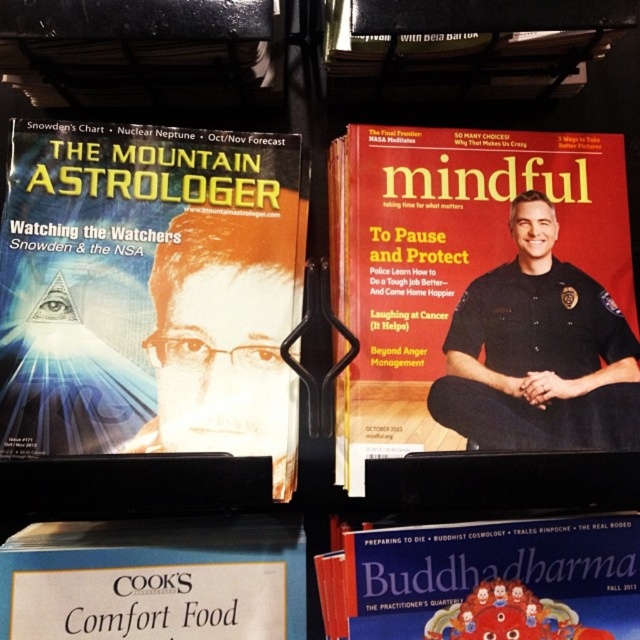
You are organizing a display in a bookstore and need to place the matte paper buddha dharma at center and the white paper comfort food at lower left on a shelf. Based on their sizes, which one should you place first to ensure stability?

The matte paper buddha dharma at center should be placed first because it is much taller than the white paper comfort food at lower left, so placing the taller item first ensures stability on the shelf.

You are organizing a shelf and need to place two magazines. The matte black magazine at upper right and the matte paper buddha dharma at center. Which magazine requires more space on the shelf?

The matte black magazine at upper right requires more space on the shelf because it is bigger than the matte paper buddha dharma at center.

You are standing in front of a bookstore shelf with two points marked. The first point is at coordinates point (4, 440) and the second is at point (380, 202). Which point is closer to you?

Point (4, 440) is closer to the viewer than point (380, 202).